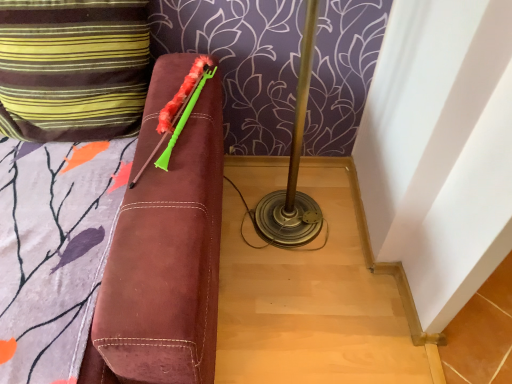
Image resolution: width=512 pixels, height=384 pixels. What do you see at coordinates (72, 69) in the screenshot? I see `striped fabric pillow at upper left` at bounding box center [72, 69].

Where is `striped fabric pillow at upper left`? The width and height of the screenshot is (512, 384). striped fabric pillow at upper left is located at coordinates (72, 69).

At what (x,y) coordinates should I click in order to perform the action: click on striped fabric pillow at upper left. Please return your answer as a coordinate pair (x, y). Looking at the image, I should click on (72, 69).